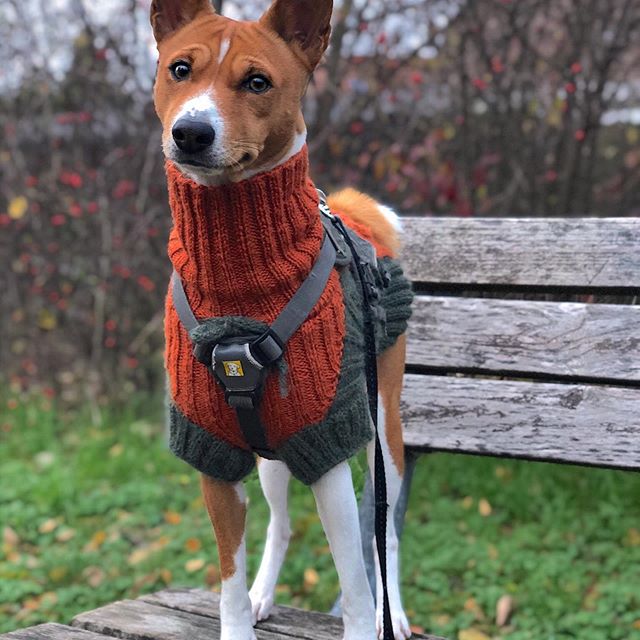
Where is `left front leg`? This screenshot has width=640, height=640. left front leg is located at coordinates (337, 531).